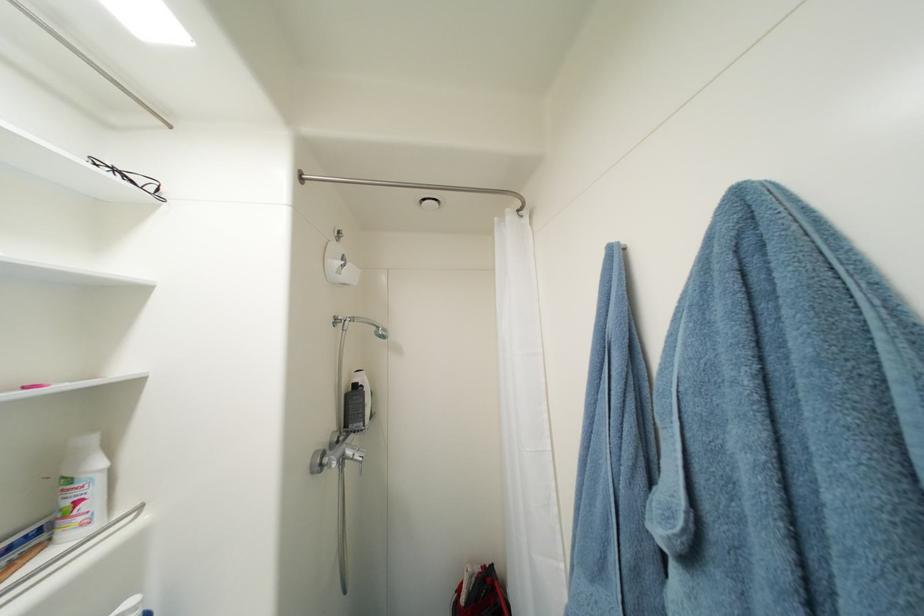
This screenshot has width=924, height=616. What are the coordinates of `blue robe loop` in the screenshot? It's located at (684, 533).